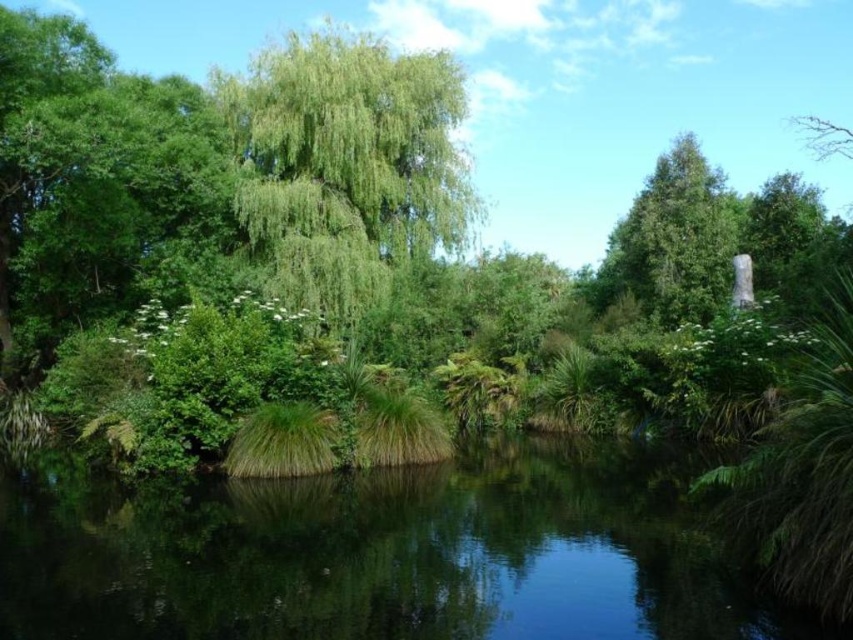
Question: Which of the following is the farthest from the observer?

Choices:
 (A) green leafy tree at upper center
 (B) green matte tree at upper right
 (C) green grassy lake at center

Answer: (A)

Question: Which object is positioned closest to the green leafy tree at upper center?

Choices:
 (A) green grassy lake at center
 (B) green matte tree at upper right

Answer: (B)

Question: Which object is the closest to the green grassy lake at center?

Choices:
 (A) green leafy tree at upper center
 (B) green matte tree at upper right

Answer: (B)

Question: Can you confirm if green grassy lake at center is thinner than green leafy tree at upper center?

Choices:
 (A) yes
 (B) no

Answer: (B)

Question: Is green leafy tree at upper center thinner than green matte tree at upper right?

Choices:
 (A) yes
 (B) no

Answer: (B)

Question: Is green grassy lake at center to the right of green matte tree at upper right from the viewer's perspective?

Choices:
 (A) no
 (B) yes

Answer: (A)